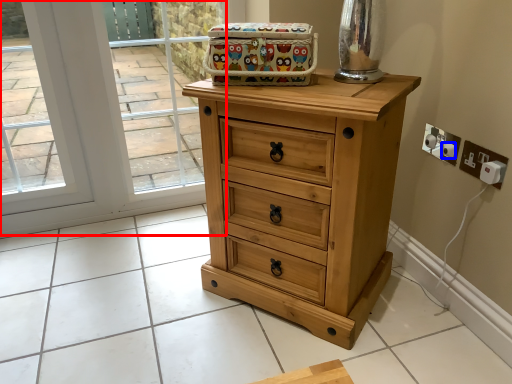
Question: Among these objects, which one is nearest to the camera, glass door (highlighted by a red box) or knob (highlighted by a blue box)?

Choices:
 (A) glass door
 (B) knob

Answer: (B)